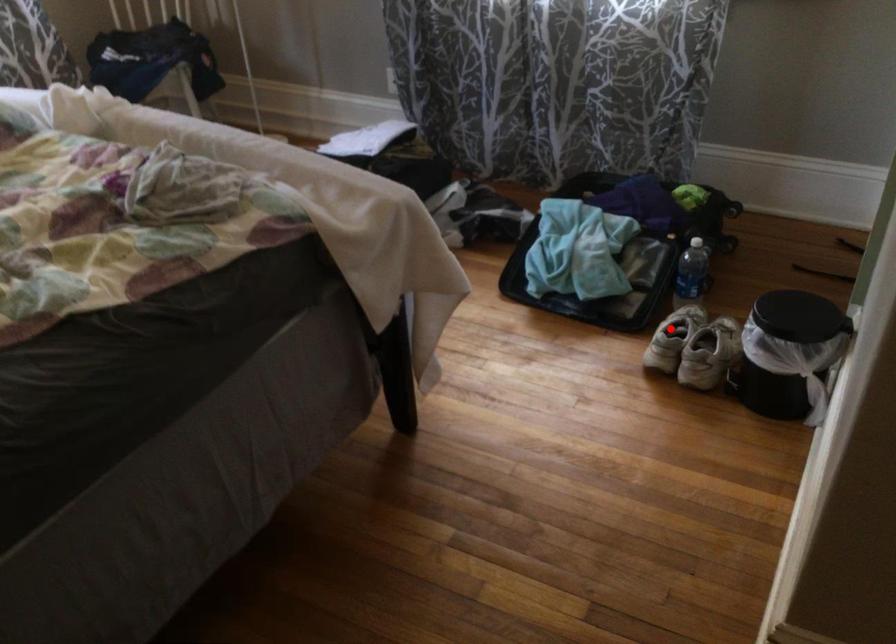
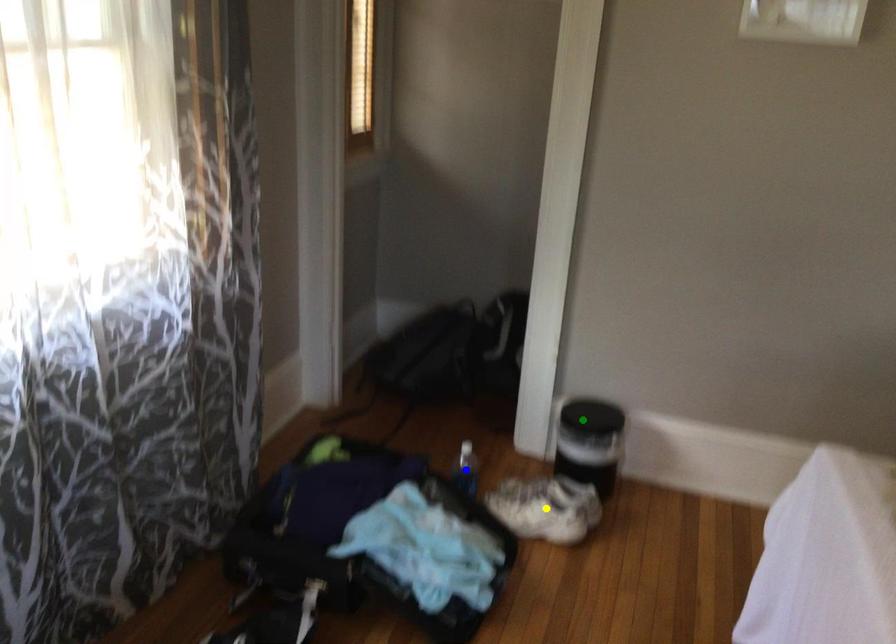
Question: I am providing you with two images of the same scene from different viewpoints. A red point is marked on the first image. You are given multiple points on the second image. In image 2, which mark is for the same physical point as the one in image 1?

Choices:
 (A) yellow point
 (B) green point
 (C) blue point

Answer: (A)